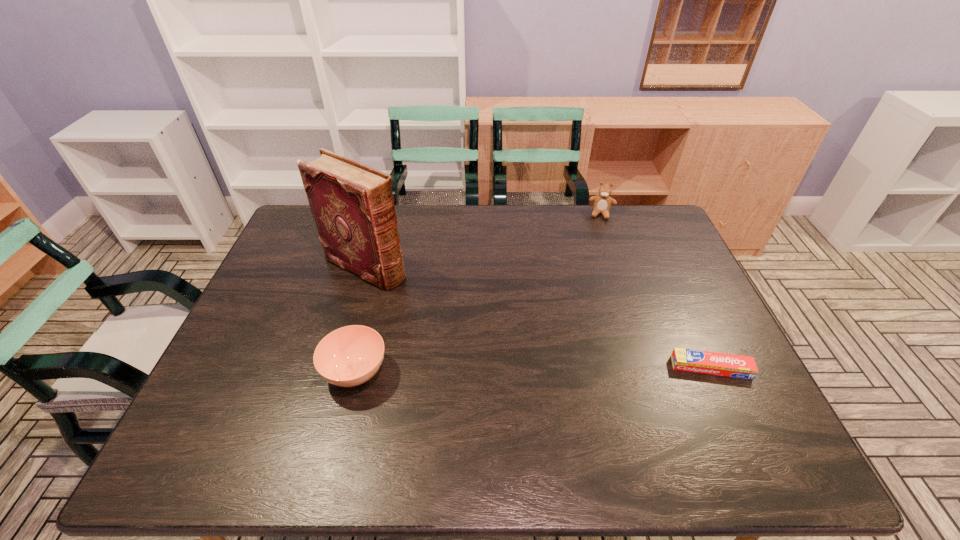
Find the location of a particular element. the second shortest object is located at coordinates (349, 356).

Where is `toothpaste`? The image size is (960, 540). toothpaste is located at coordinates (706, 362).

Image resolution: width=960 pixels, height=540 pixels. Find the location of `the third nearest object`. the third nearest object is located at coordinates (352, 204).

Identify the location of hardback book. (352, 204).

Identify the location of the farthest object. Image resolution: width=960 pixels, height=540 pixels. (602, 202).

Identify the location of the third shortest object. This screenshot has width=960, height=540. (602, 202).

You are a GUI agent. You are given a task and a screenshot of the screen. Output one action in this format:
    pyautogui.click(x=<x>, y=<y>)
    Task: Click on the vacant space located 0.230m on the back of the second shortest object
    
    Given the screenshot: What is the action you would take?
    pyautogui.click(x=376, y=285)

Locate an element on the screen. This screenshot has height=540, width=960. vacant space located 0.380m on the left of the toothpaste is located at coordinates (522, 367).

This screenshot has width=960, height=540. Find the location of `free space located 0.190m on the spine side of the third nearest object`. free space located 0.190m on the spine side of the third nearest object is located at coordinates (447, 306).

The image size is (960, 540). I want to click on free spot located on the spine side of the third nearest object, so click(437, 300).